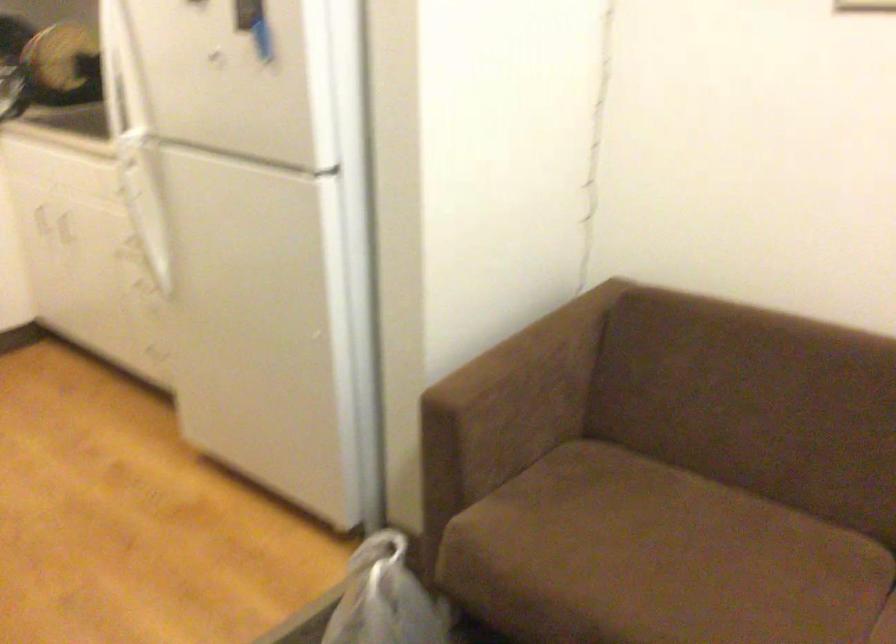
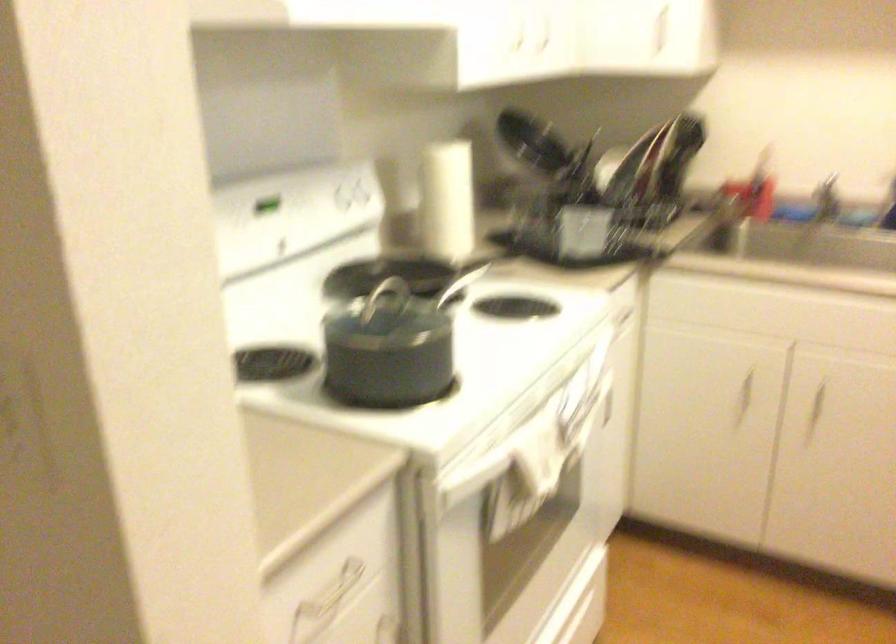
The images are taken continuously from a first-person perspective. In which direction are you moving?

The cameraman walked toward left, forward.